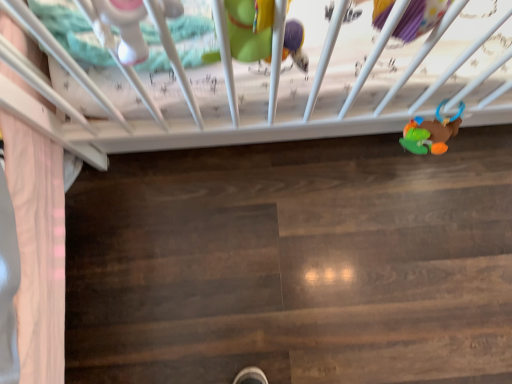
Question: Considering the relative sizes of matte plastic rattle at upper left, the third toy when ordered from right to left, and rubberized plastic rattle at lower right, the first toy from the back, in the image provided, is matte plastic rattle at upper left, the third toy when ordered from right to left, shorter than rubberized plastic rattle at lower right, the first toy from the back,?

Choices:
 (A) yes
 (B) no

Answer: (B)

Question: Considering the relative sizes of matte plastic rattle at upper left, the third toy when ordered from right to left, and rubberized plastic rattle at lower right, the first toy from the back, in the image provided, is matte plastic rattle at upper left, the third toy when ordered from right to left, wider than rubberized plastic rattle at lower right, the first toy from the back,?

Choices:
 (A) yes
 (B) no

Answer: (B)

Question: Is matte plastic rattle at upper left, which is the first toy in front-to-back order, closer to the viewer compared to rubberized plastic rattle at lower right, the 1th toy viewed from the right?

Choices:
 (A) no
 (B) yes

Answer: (B)

Question: Are matte plastic rattle at upper left, the third toy when ordered from right to left, and rubberized plastic rattle at lower right, the 1th toy viewed from the right, located far from each other?

Choices:
 (A) no
 (B) yes

Answer: (A)

Question: Is matte plastic rattle at upper left, which is the first toy in front-to-back order, facing away from rubberized plastic rattle at lower right, the 1th toy viewed from the right?

Choices:
 (A) yes
 (B) no

Answer: (B)

Question: Is matte plastic rattle at upper left, which is the first toy in front-to-back order, completely or partially outside of rubberized plastic rattle at lower right, the first toy from the back?

Choices:
 (A) yes
 (B) no

Answer: (A)

Question: Is matte plastic rattle at upper left, which is the first toy in front-to-back order, directly adjacent to matte green plush toy at upper center, which ranks as the second toy in back-to-front order?

Choices:
 (A) no
 (B) yes

Answer: (A)

Question: Considering the relative positions of matte plastic rattle at upper left, the third toy when ordered from right to left, and matte green plush toy at upper center, which ranks as the second toy in back-to-front order, in the image provided, is matte plastic rattle at upper left, the third toy when ordered from right to left, to the right of matte green plush toy at upper center, which ranks as the second toy in back-to-front order, from the viewer's perspective?

Choices:
 (A) no
 (B) yes

Answer: (A)

Question: Is matte plastic rattle at upper left, which is the first toy in front-to-back order, further to camera compared to matte green plush toy at upper center, which ranks as the second toy in right-to-left order?

Choices:
 (A) yes
 (B) no

Answer: (B)

Question: Is matte plastic rattle at upper left, the third toy when ordered from right to left, to the left of matte green plush toy at upper center, which is the second toy from front to back, from the viewer's perspective?

Choices:
 (A) yes
 (B) no

Answer: (A)

Question: Does matte plastic rattle at upper left, which is the first toy in front-to-back order, have a greater width compared to matte green plush toy at upper center, which is the second toy from front to back?

Choices:
 (A) yes
 (B) no

Answer: (A)

Question: From the image's perspective, would you say matte plastic rattle at upper left, acting as the first toy starting from the left, is positioned over matte green plush toy at upper center, which is the second toy from front to back?

Choices:
 (A) yes
 (B) no

Answer: (B)

Question: From a real-world perspective, is matte green plush toy at upper center, which ranks as the second toy in right-to-left order, located beneath rubberized plastic rattle at lower right, the 1th toy viewed from the right?

Choices:
 (A) yes
 (B) no

Answer: (B)